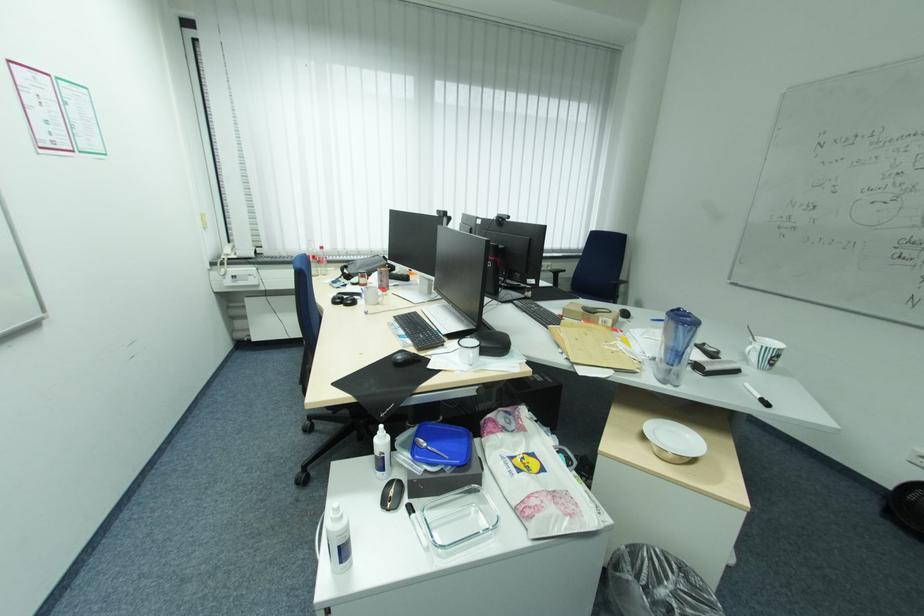
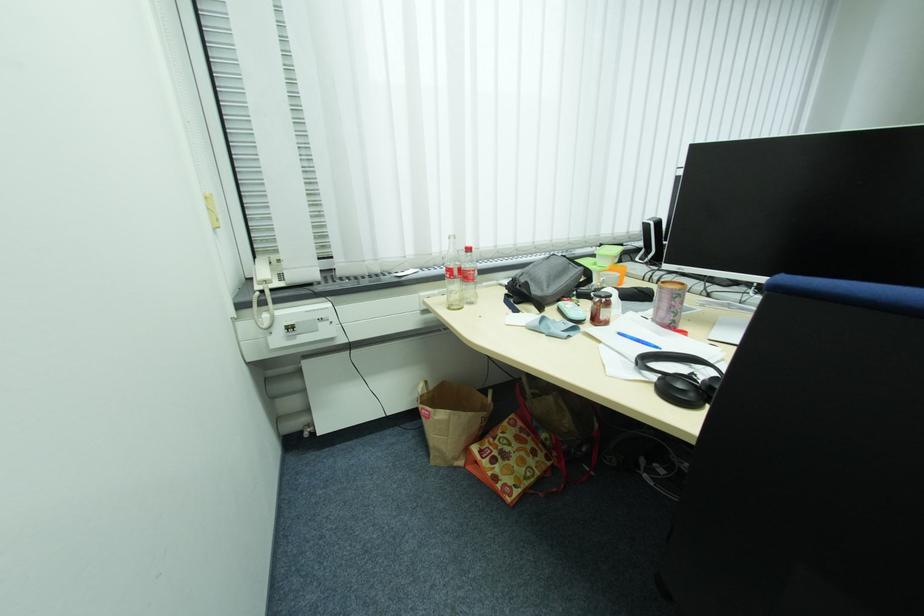
Locate, in the second image, the point that corresponds to (x=363, y=270) in the first image.

(554, 286)